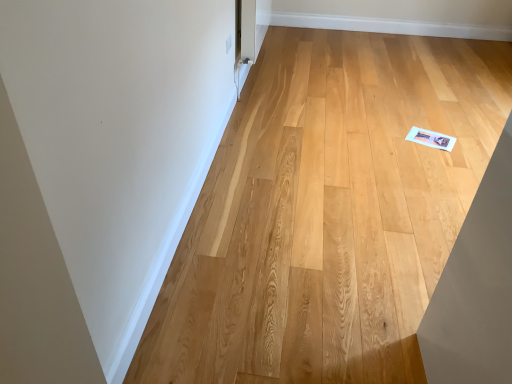
This screenshot has width=512, height=384. Identify the location of free space in front of white glossy door at upper center. (282, 103).